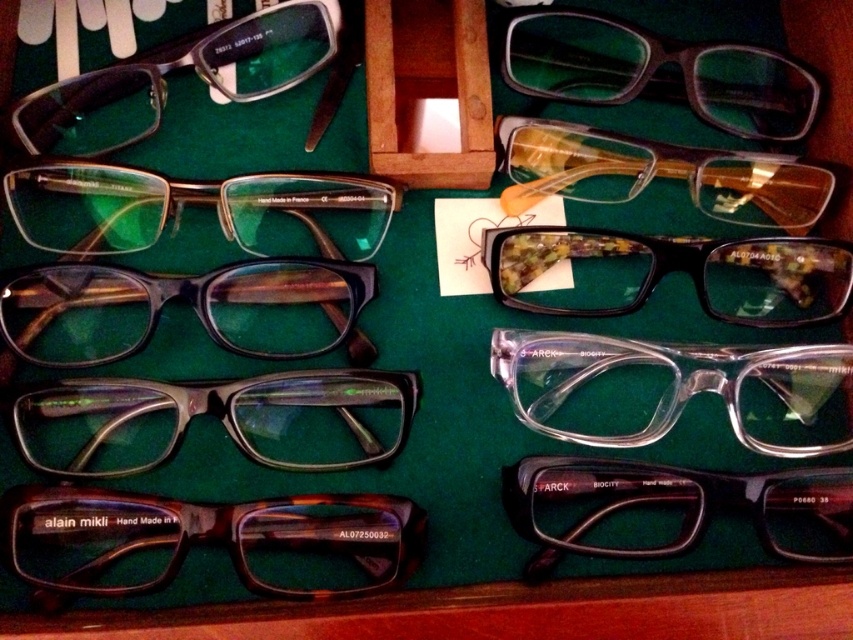
Is point (54, 221) in front of point (62, 132)?

That is True.

Does matte brown glasses at upper left have a larger size compared to matte black glasses at upper left?

No.

In order to click on matte brown glasses at upper left in this screenshot , I will do `click(190, 204)`.

Can you confirm if tortoiseshell acetate glasses at bottom left is smaller than wooden box at center?

No, tortoiseshell acetate glasses at bottom left is not smaller than wooden box at center.

Can you confirm if tortoiseshell acetate glasses at bottom left is shorter than wooden box at center?

Yes, tortoiseshell acetate glasses at bottom left is shorter than wooden box at center.

Locate an element on the screen. The image size is (853, 640). tortoiseshell acetate glasses at bottom left is located at coordinates (207, 540).

At what (x,y) coordinates should I click in order to perform the action: click on tortoiseshell acetate glasses at bottom left. Please return your answer as a coordinate pair (x, y). The height and width of the screenshot is (640, 853). Looking at the image, I should click on (207, 540).

Between point (165, 540) and point (619, 435), which one is positioned behind?

The point (619, 435) is more distant.

Is point (45, 577) closer to camera compared to point (703, 384)?

Yes, point (45, 577) is in front of point (703, 384).

Is point (86, 589) positioned behind point (659, 369)?

That is False.

Locate an element on the screen. This screenshot has height=640, width=853. tortoiseshell acetate glasses at bottom left is located at coordinates (207, 540).